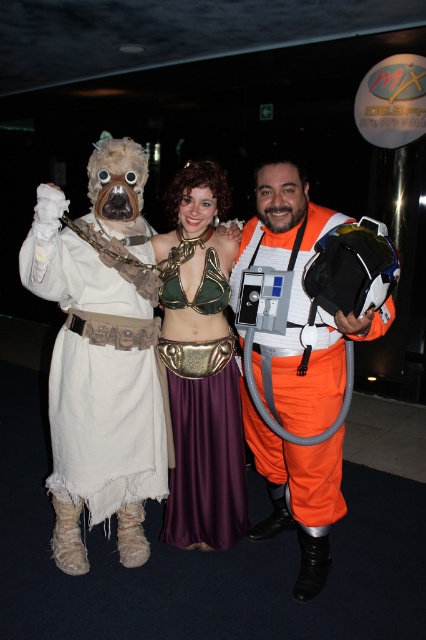
Question: Which is nearer to the velvet purple skirt at center?

Choices:
 (A) fuzzy white costume at left
 (B) velvet purple dress at center
 (C) shiny metallic armor at center
 (D) orange fabric spacesuit at center

Answer: (B)

Question: Is shiny metallic armor at center wider than velvet purple skirt at center?

Choices:
 (A) no
 (B) yes

Answer: (B)

Question: Which point appears farthest from the camera in this image?

Choices:
 (A) (40, 266)
 (B) (238, 518)
 (C) (180, 228)

Answer: (B)

Question: Which of the following is the closest to the observer?

Choices:
 (A) velvet purple skirt at center
 (B) fuzzy white costume at left

Answer: (B)

Question: Is shiny metallic armor at center bigger than velvet purple skirt at center?

Choices:
 (A) no
 (B) yes

Answer: (B)

Question: Can you confirm if fuzzy white costume at left is bigger than orange fabric spacesuit at center?

Choices:
 (A) yes
 (B) no

Answer: (B)